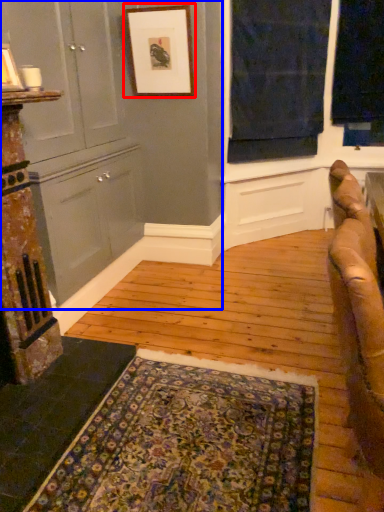
Question: Which object is closer to the camera taking this photo, picture frame (highlighted by a red box) or dresser (highlighted by a blue box)?

Choices:
 (A) picture frame
 (B) dresser

Answer: (B)